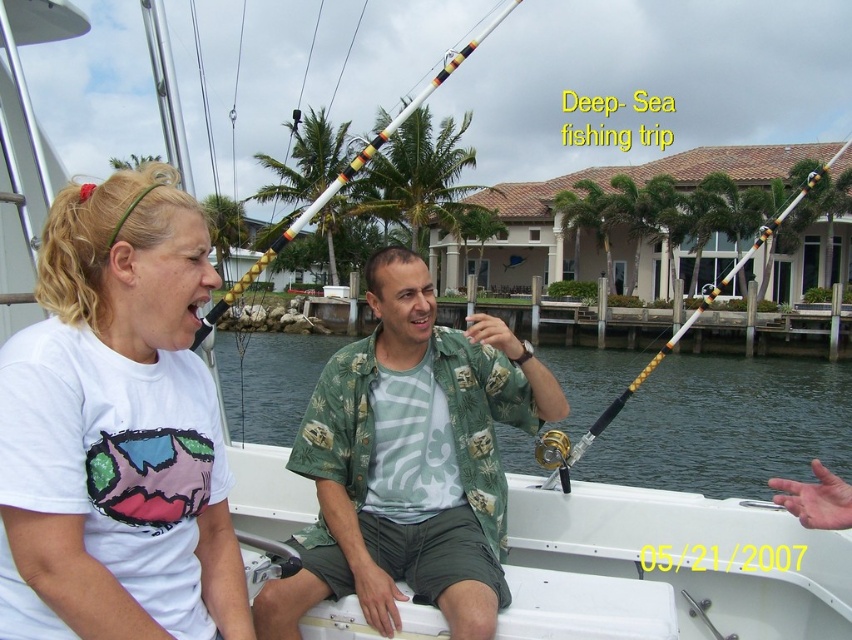
Does clear water at center come behind white plastic fishing rod at center?

Yes, clear water at center is behind white plastic fishing rod at center.

Between clear water at center and white plastic fishing rod at center, which one is positioned lower?

Positioned lower is clear water at center.

The height and width of the screenshot is (640, 852). Describe the element at coordinates (727, 426) in the screenshot. I see `clear water at center` at that location.

Image resolution: width=852 pixels, height=640 pixels. I want to click on clear water at center, so click(x=727, y=426).

Does point (311, 436) come behind point (554, 433)?

No, it is in front of (554, 433).

Can you confirm if green floral shirt at center is shorter than gold metallic fishing pole at upper center?

Correct, green floral shirt at center is not as tall as gold metallic fishing pole at upper center.

Find the location of a particular element. This screenshot has width=852, height=640. green floral shirt at center is located at coordinates (410, 461).

Locate an element on the screen. This screenshot has height=640, width=852. green floral shirt at center is located at coordinates (410, 461).

Is white matte t-shirt at left smaller than gold metallic fishing pole at upper center?

Yes, white matte t-shirt at left is smaller than gold metallic fishing pole at upper center.

Describe the element at coordinates (117, 428) in the screenshot. I see `white matte t-shirt at left` at that location.

Locate an element on the screen. The image size is (852, 640). white matte t-shirt at left is located at coordinates (117, 428).